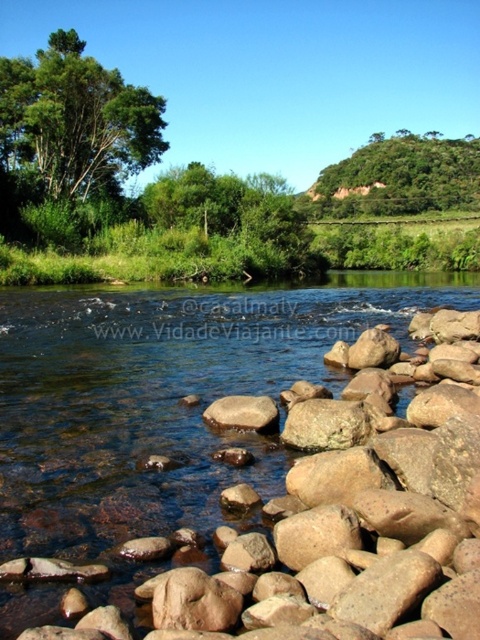
Question: Which object is positioned farthest from the brown rough rock at lower center?

Choices:
 (A) green leafy tree at upper center
 (B) smooth brown rock at center

Answer: (A)

Question: In this image, where is green leafy tree at upper left located relative to smooth brown rock at center?

Choices:
 (A) right
 (B) left

Answer: (B)

Question: Which of the following is the closest to the observer?

Choices:
 (A) smooth brown rock at center
 (B) green leafy tree at upper left
 (C) green leafy tree at upper center
 (D) brown rough rock at lower center

Answer: (D)

Question: Is green leafy tree at upper center to the right of smooth brown rock at center from the viewer's perspective?

Choices:
 (A) yes
 (B) no

Answer: (A)

Question: Estimate the real-world distances between objects in this image. Which object is closer to the smooth brown rock at center?

Choices:
 (A) green leafy tree at upper left
 (B) green leafy tree at upper center

Answer: (A)

Question: Does brown rough rock at lower center come behind green leafy tree at upper center?

Choices:
 (A) yes
 (B) no

Answer: (B)